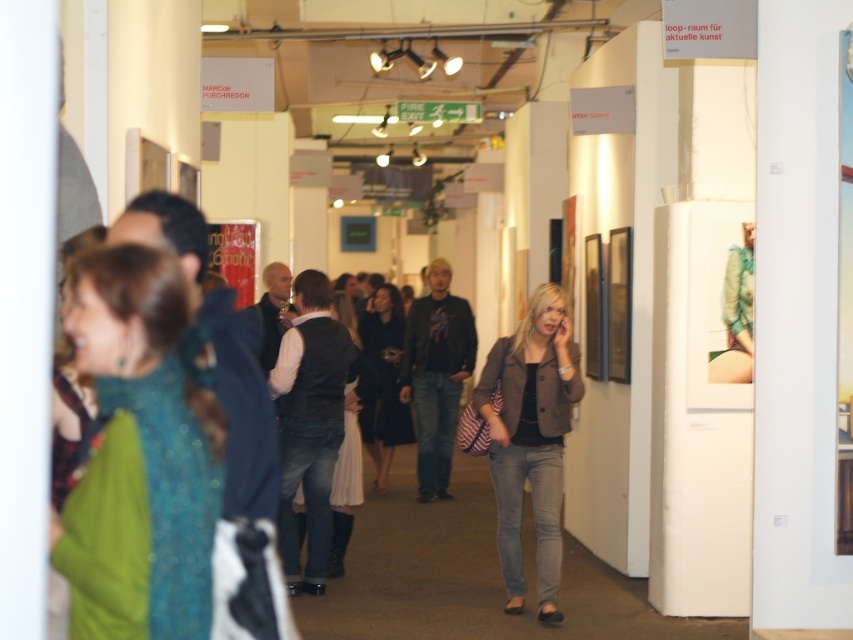
Which is behind, point (154, 467) or point (381, 435)?

The point (381, 435) is more distant.

Is green sequined dress at left closer to the viewer compared to black dress at center?

Yes.

The height and width of the screenshot is (640, 853). Identify the location of green sequined dress at left. (141, 452).

Find the location of a particular element. The width and height of the screenshot is (853, 640). green sequined dress at left is located at coordinates coord(141,452).

Can you confirm if green sequined dress at left is smaller than matte brown blazer at center?

Indeed, green sequined dress at left has a smaller size compared to matte brown blazer at center.

Between point (183, 387) and point (496, 458), which one is positioned in front?

Positioned in front is point (183, 387).

Who is more distant from viewer, [161,499] or [509,442]?

Positioned behind is point [509,442].

The width and height of the screenshot is (853, 640). What are the coordinates of `green sequined dress at left` in the screenshot? It's located at (141, 452).

What do you see at coordinates (531, 438) in the screenshot?
I see `matte brown blazer at center` at bounding box center [531, 438].

Is point (572, 348) closer to camera compared to point (390, 384)?

Yes, point (572, 348) is closer to viewer.

What do you see at coordinates (531, 438) in the screenshot?
I see `matte brown blazer at center` at bounding box center [531, 438].

Identify the location of matte brown blazer at center. (531, 438).